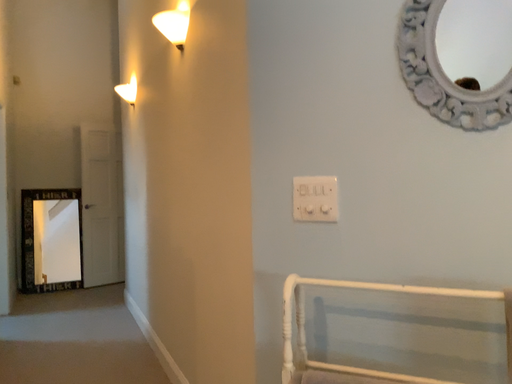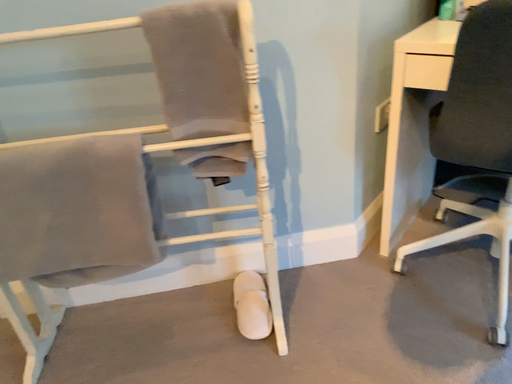
Question: How did the camera likely rotate when shooting the video?

Choices:
 (A) rotated upward
 (B) rotated downward

Answer: (B)